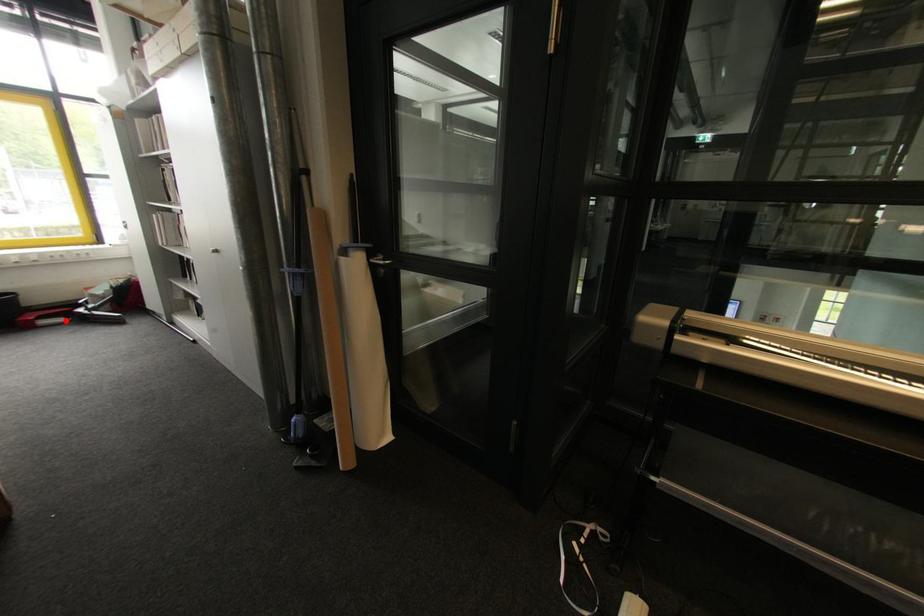
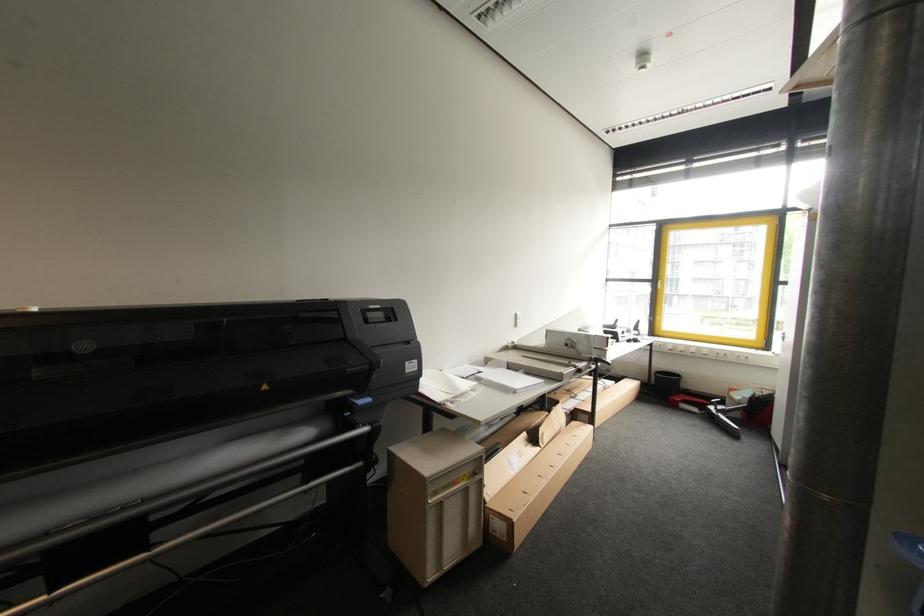
Where in the second image is the point corresponding to the highlighted location from the first image?

(699, 411)